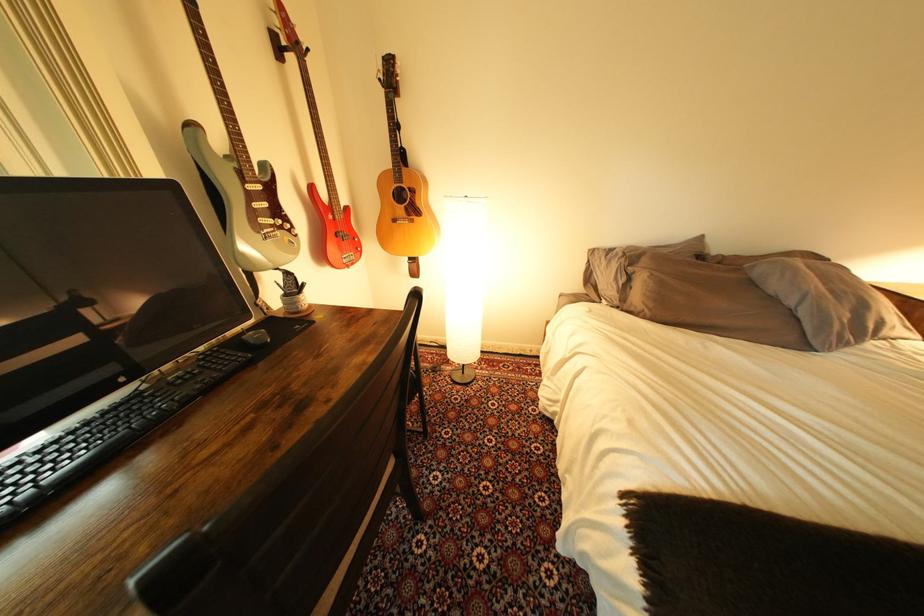
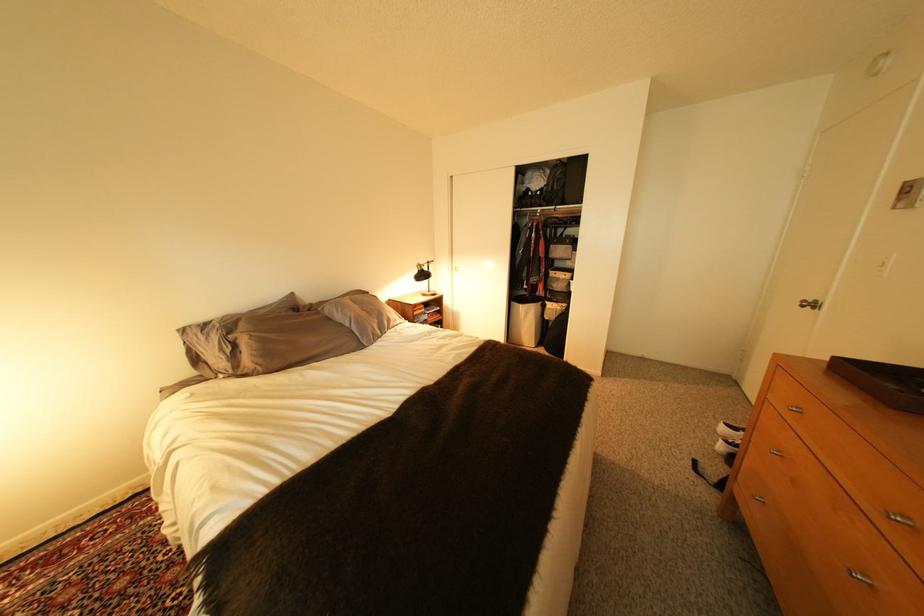
In the second image, find the point that corresponds to point 767,268 in the first image.

(335, 310)